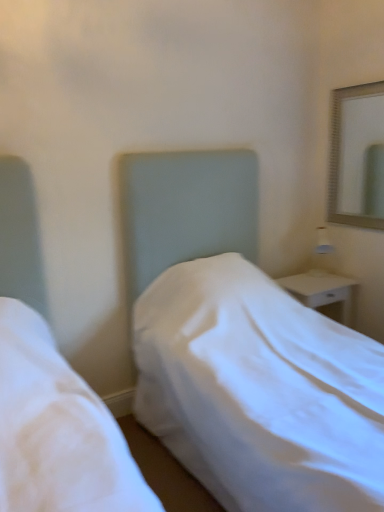
Locate an element on the screen. This screenshot has width=384, height=512. white fabric bed at center is located at coordinates (231, 342).

Identify the location of silver metallic mirror at upper right. (357, 157).

Can you confirm if white fabric bed at center is wider than white glossy nightstand at right?

Yes.

From a real-world perspective, is white fabric bed at center under white glossy nightstand at right?

Incorrect, from a real-world perspective, white fabric bed at center is higher than white glossy nightstand at right.

Is white fabric bed at center positioned far away from white glossy nightstand at right?

No, there isn't a large distance between white fabric bed at center and white glossy nightstand at right.

Who is bigger, white fabric bed at center or white glossy nightstand at right?

Bigger between the two is white fabric bed at center.

Measure the distance between white glossy nightstand at right and white fabric bed at center.

The distance of white glossy nightstand at right from white fabric bed at center is 81.27 centimeters.

Looking at the image, does white glossy nightstand at right seem bigger or smaller compared to white fabric bed at center?

In the image, white glossy nightstand at right appears to be smaller than white fabric bed at center.

From the image's perspective, is white glossy nightstand at right beneath white fabric bed at center?

Yes.

Can you confirm if white glossy nightstand at right is thinner than white fabric bed at center?

Indeed, white glossy nightstand at right has a lesser width compared to white fabric bed at center.

Based on the photo, is white glossy nightstand at right looking in the opposite direction of silver metallic mirror at upper right?

No, white glossy nightstand at right's orientation is not away from silver metallic mirror at upper right.

Considering the positions of point (348, 321) and point (359, 108), is point (348, 321) closer or farther from the camera than point (359, 108)?

Clearly, point (348, 321) is closer to the camera than point (359, 108).

Locate an element on the screen. The height and width of the screenshot is (512, 384). nightstand on the left of silver metallic mirror at upper right is located at coordinates 324,292.

From the picture: Which is more to the left, white glossy nightstand at right or silver metallic mirror at upper right?

From the viewer's perspective, white glossy nightstand at right appears more on the left side.

Is silver metallic mirror at upper right closer to the viewer compared to white glossy nightstand at right?

Yes, silver metallic mirror at upper right is closer to the camera.

Considering the sizes of objects silver metallic mirror at upper right and white glossy nightstand at right in the image provided, who is smaller, silver metallic mirror at upper right or white glossy nightstand at right?

With smaller size is silver metallic mirror at upper right.

Is point (339, 100) more distant than point (284, 278)?

Yes, it is behind point (284, 278).

Between silver metallic mirror at upper right and white glossy nightstand at right, which one has larger width?

white glossy nightstand at right is wider.

Considering the sizes of objects silver metallic mirror at upper right and white fabric bed at center in the image provided, who is wider, silver metallic mirror at upper right or white fabric bed at center?

white fabric bed at center is wider.

Locate an element on the screen. The image size is (384, 512). bed on the left of silver metallic mirror at upper right is located at coordinates (231, 342).

From the picture: Is silver metallic mirror at upper right closer to camera compared to white fabric bed at center?

No, the depth of silver metallic mirror at upper right is greater than that of white fabric bed at center.

Considering the sizes of objects white fabric bed at center and silver metallic mirror at upper right in the image provided, who is wider, white fabric bed at center or silver metallic mirror at upper right?

Wider between the two is white fabric bed at center.

From the image's perspective, is white fabric bed at center above or below silver metallic mirror at upper right?

white fabric bed at center is below silver metallic mirror at upper right.

Looking at this image, who is more distant, white fabric bed at center or silver metallic mirror at upper right?

silver metallic mirror at upper right.

Is white fabric bed at center far away from silver metallic mirror at upper right?

Yes.

This screenshot has height=512, width=384. I want to click on bed above the white glossy nightstand at right (from the image's perspective), so click(x=231, y=342).

This screenshot has width=384, height=512. I want to click on nightstand directly beneath the white fabric bed at center (from a real-world perspective), so click(324, 292).

Based on the photo, when comparing their distances from white fabric bed at center, does silver metallic mirror at upper right or white glossy nightstand at right seem further?

Based on the image, silver metallic mirror at upper right appears to be further to white fabric bed at center.

Looking at this image, from the image, which object appears to be nearer to silver metallic mirror at upper right, white fabric bed at center or white glossy nightstand at right?

white glossy nightstand at right is closer to silver metallic mirror at upper right.

From the image, which object appears to be nearer to white fabric bed at center, white glossy nightstand at right or silver metallic mirror at upper right?

Based on the image, white glossy nightstand at right appears to be nearer to white fabric bed at center.

Considering their positions, is white fabric bed at center positioned further to white glossy nightstand at right than silver metallic mirror at upper right?

The object further to white glossy nightstand at right is silver metallic mirror at upper right.

Based on their spatial positions, is white glossy nightstand at right or white fabric bed at center further from silver metallic mirror at upper right?

white fabric bed at center lies further to silver metallic mirror at upper right than the other object.

When comparing their distances from white glossy nightstand at right, does silver metallic mirror at upper right or white fabric bed at center seem further?

silver metallic mirror at upper right lies further to white glossy nightstand at right than the other object.

Locate an element on the screen. mirror between white fabric bed at center and white glossy nightstand at right along the z-axis is located at coordinates (357, 157).